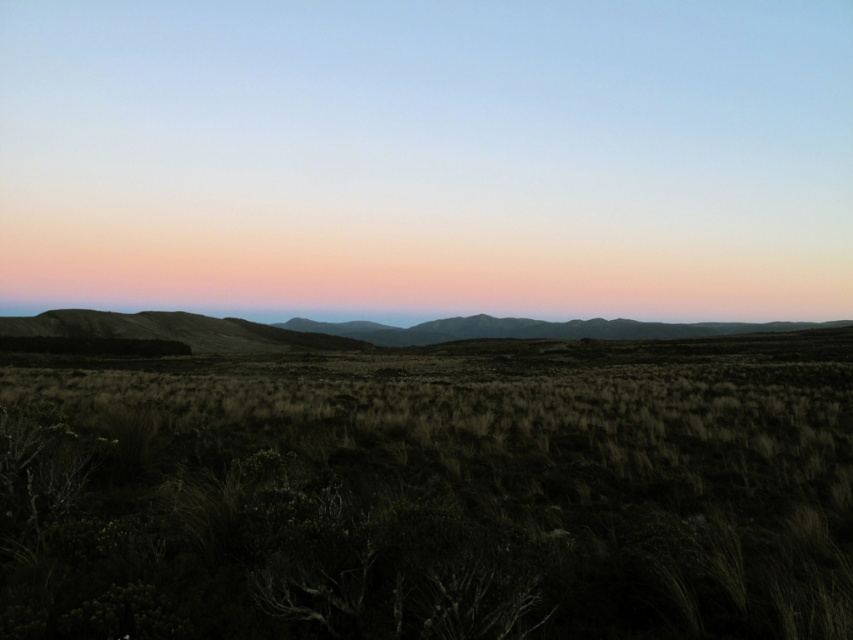
From the picture: You are standing at the point closer to the horizon between the two points, point (827,241) and point (604,586). Which point are you standing at?

You are standing at point (604,586) because it is closer to the horizon than point (827,241), which is further away from you.

You are standing on the smooth grassy plain at center and want to walk towards the brown rough grass at center. In which direction should you head?

The smooth grassy plain at center is to the left of brown rough grass at center, so you should head to the right to reach the brown rough grass at center.